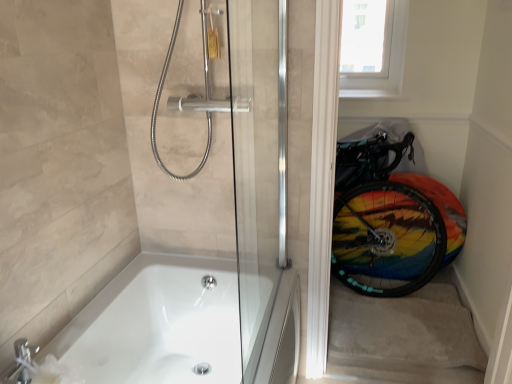
Question: Considering the relative sizes of white plastic window screen at upper right and white glossy bathtub at lower left in the image provided, is white plastic window screen at upper right smaller than white glossy bathtub at lower left?

Choices:
 (A) yes
 (B) no

Answer: (A)

Question: From a real-world perspective, is white plastic window screen at upper right physically below white glossy bathtub at lower left?

Choices:
 (A) yes
 (B) no

Answer: (B)

Question: Does white plastic window screen at upper right have a greater width compared to white glossy bathtub at lower left?

Choices:
 (A) no
 (B) yes

Answer: (A)

Question: Does white plastic window screen at upper right turn towards white glossy bathtub at lower left?

Choices:
 (A) yes
 (B) no

Answer: (A)

Question: Are white plastic window screen at upper right and white glossy bathtub at lower left making contact?

Choices:
 (A) no
 (B) yes

Answer: (A)

Question: In terms of size, does transparent glass door at right appear bigger or smaller than carpeted stairwell at lower right?

Choices:
 (A) big
 (B) small

Answer: (A)

Question: Considering the positions of transparent glass door at right and carpeted stairwell at lower right in the image, is transparent glass door at right taller or shorter than carpeted stairwell at lower right?

Choices:
 (A) tall
 (B) short

Answer: (A)

Question: From a real-world perspective, is transparent glass door at right above or below carpeted stairwell at lower right?

Choices:
 (A) below
 (B) above

Answer: (B)

Question: From the image's perspective, relative to carpeted stairwell at lower right, is transparent glass door at right above or below?

Choices:
 (A) above
 (B) below

Answer: (A)

Question: Is transparent glass door at right in front of or behind white glossy bathtub at lower left in the image?

Choices:
 (A) behind
 (B) front

Answer: (A)

Question: Do you think transparent glass door at right is within white glossy bathtub at lower left, or outside of it?

Choices:
 (A) outside
 (B) inside

Answer: (A)

Question: From a real-world perspective, is transparent glass door at right physically located above or below white glossy bathtub at lower left?

Choices:
 (A) above
 (B) below

Answer: (A)

Question: Is point (442, 51) positioned closer to the camera than point (112, 372)?

Choices:
 (A) closer
 (B) farther

Answer: (B)

Question: Would you say white plastic window screen at upper right is to the left or to the right of carpeted stairwell at lower right in the picture?

Choices:
 (A) left
 (B) right

Answer: (A)

Question: Based on their sizes in the image, would you say white plastic window screen at upper right is bigger or smaller than carpeted stairwell at lower right?

Choices:
 (A) small
 (B) big

Answer: (A)